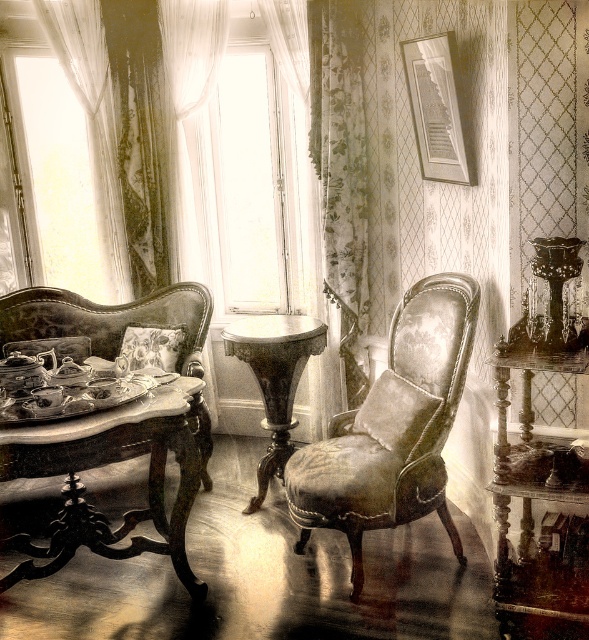
Image resolution: width=589 pixels, height=640 pixels. What do you see at coordinates (133, 113) in the screenshot?
I see `white sheer curtain at left` at bounding box center [133, 113].

Can you confirm if white sheer curtain at left is smaller than transparent glass window at center?

No, white sheer curtain at left is not smaller than transparent glass window at center.

This screenshot has width=589, height=640. What are the coordinates of `white sheer curtain at left` in the screenshot? It's located at (133, 113).

Find the location of a particular element. white sheer curtain at left is located at coordinates (133, 113).

Is velvet-like beige armchair at center closer to the viewer compared to white sheer curtain at left?

Yes, it is.

What do you see at coordinates (392, 428) in the screenshot? The height and width of the screenshot is (640, 589). I see `velvet-like beige armchair at center` at bounding box center [392, 428].

Image resolution: width=589 pixels, height=640 pixels. In order to click on velvet-like beige armchair at center in this screenshot , I will do `click(392, 428)`.

Is transparent glass window at center closer to camera compared to marble pedestal table at center?

No, it is behind marble pedestal table at center.

Which is behind, point (260, 147) or point (289, 365)?

Point (260, 147)

The width and height of the screenshot is (589, 640). What do you see at coordinates (252, 184) in the screenshot?
I see `transparent glass window at center` at bounding box center [252, 184].

The height and width of the screenshot is (640, 589). I want to click on transparent glass window at center, so click(x=252, y=184).